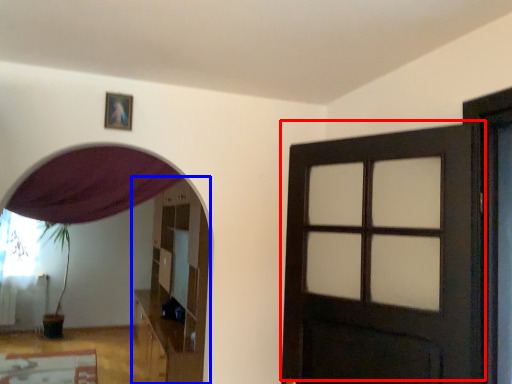
Question: Which object appears closest to the camera in this image, door (highlighted by a red box) or dresser (highlighted by a blue box)?

Choices:
 (A) door
 (B) dresser

Answer: (A)